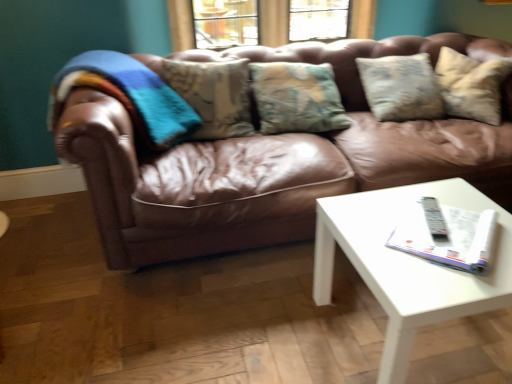
Where is `vacant space that is to the left of white glossy coffee table at lower right`? The width and height of the screenshot is (512, 384). vacant space that is to the left of white glossy coffee table at lower right is located at coordinates [263, 319].